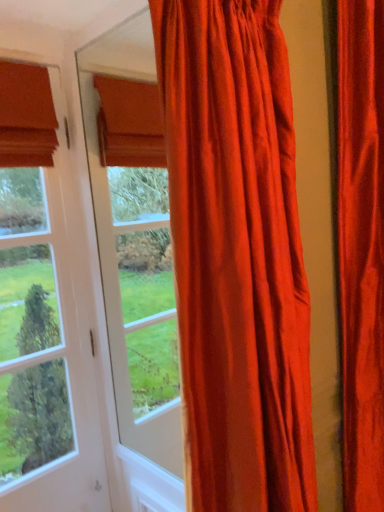
Question: From the image's perspective, is satin red curtain at right, the first curtain when ordered from right to left, positioned above or below satin orange curtain at center, which is counted as the second curtain, starting from the right?

Choices:
 (A) above
 (B) below

Answer: (B)

Question: Is point (354, 359) positioned closer to the camera than point (236, 136)?

Choices:
 (A) farther
 (B) closer

Answer: (A)

Question: Estimate the real-world distances between objects in this image. Which object is farther from the satin orange curtain at center, which is the 1th curtain in left-to-right order?

Choices:
 (A) satin red curtain at right, which is the second curtain in left-to-right order
 (B) clear glass door at left

Answer: (B)

Question: Considering the real-world distances, which object is closest to the clear glass door at left?

Choices:
 (A) satin orange curtain at center, which is the 1th curtain in left-to-right order
 (B) satin red curtain at right, which is the second curtain in left-to-right order

Answer: (A)